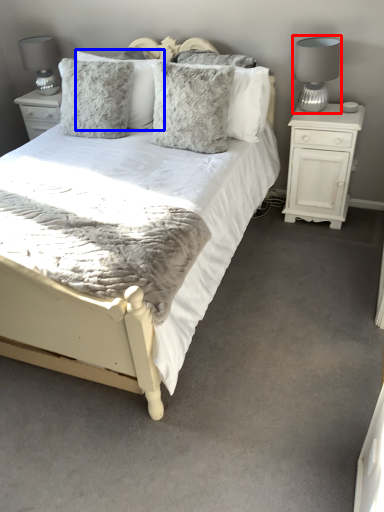
Question: Which object appears closest to the camera in this image, table lamp (highlighted by a red box) or pillow (highlighted by a blue box)?

Choices:
 (A) table lamp
 (B) pillow

Answer: (A)